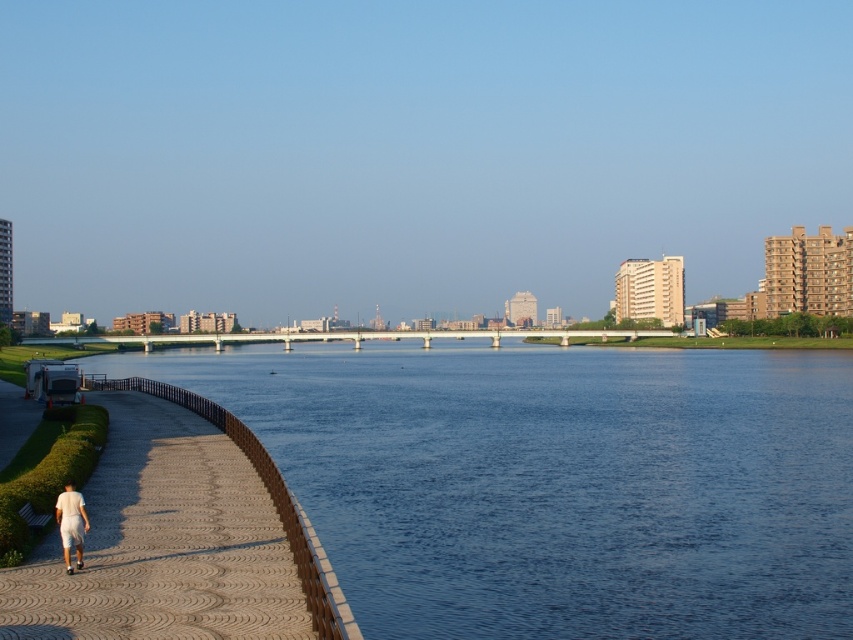
You are standing on the riverside walkway and see the blue water at center and the white cotton shorts at lower left. Which object is closer to you?

The blue water at center is closer to you because it is further to the viewer than the white cotton shorts at lower left.

You are standing on the brown textured pavement at lower left and want to step onto the white cotton shorts at lower left. Is this possible given their sizes?

The brown textured pavement at lower left is bigger than white cotton shorts at lower left, so stepping from the pavement to the shorts is possible as the pavement provides a stable base.

You are standing on the walkway and see the blue water at center and the white cotton shorts at lower left. Which object is closer to the water?

The white cotton shorts at lower left are closer to the blue water at center because they are positioned above it.